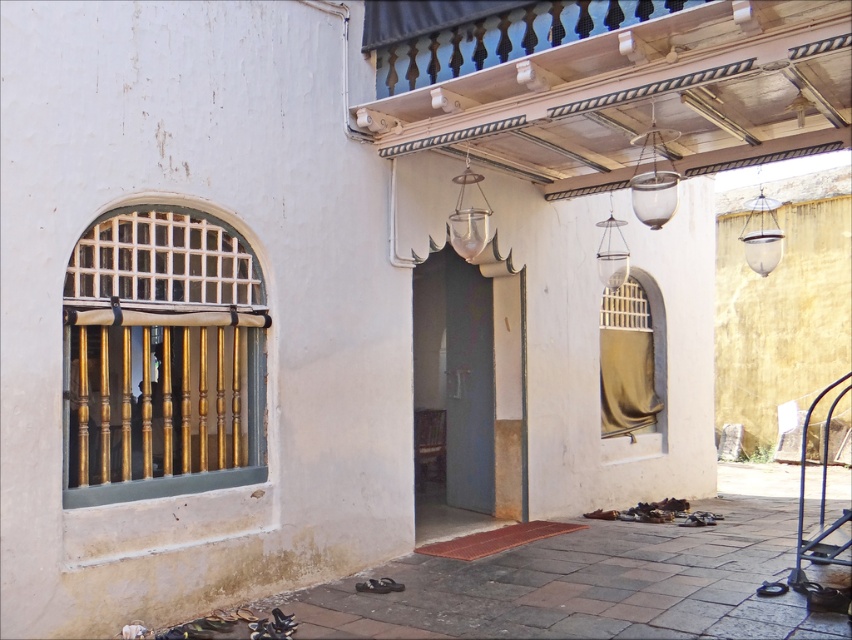
Question: Which is nearer to the translucent glass lantern at center?

Choices:
 (A) smooth concrete floor at lower center
 (B) wooden at upper center
 (C) transparent glass lamp at upper center

Answer: (B)

Question: Does wooden at upper center appear on the right side of transparent glass lamp at upper center?

Choices:
 (A) yes
 (B) no

Answer: (A)

Question: Can you confirm if wooden at upper center is positioned to the right of metallic glass pendant light at upper center?

Choices:
 (A) no
 (B) yes

Answer: (B)

Question: Estimate the real-world distances between objects in this image. Which object is closer to the metallic glass pendant light at upper center?

Choices:
 (A) smooth concrete floor at lower center
 (B) blue metal rail at lower right
 (C) wooden at upper center

Answer: (C)

Question: Which of the following is the farthest from the observer?

Choices:
 (A) (481, 49)
 (B) (634, 552)
 (C) (829, 557)
 (D) (476, 246)

Answer: (B)

Question: Where is wooden at upper center located in relation to transparent glass lamp at upper center in the image?

Choices:
 (A) left
 (B) right

Answer: (B)